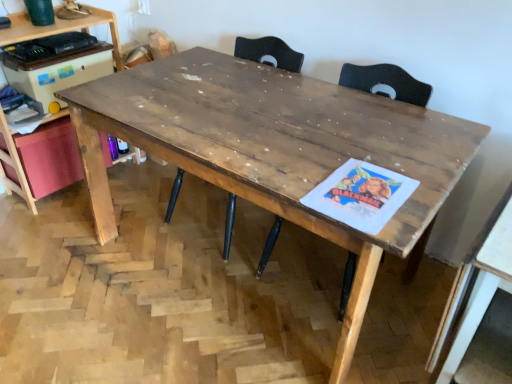
Locate an element on the screen. Image resolution: width=512 pixels, height=384 pixels. free region under wooden table at center, placed as the second table when sorted from right to left (from a real-world perspective) is located at coordinates (241, 284).